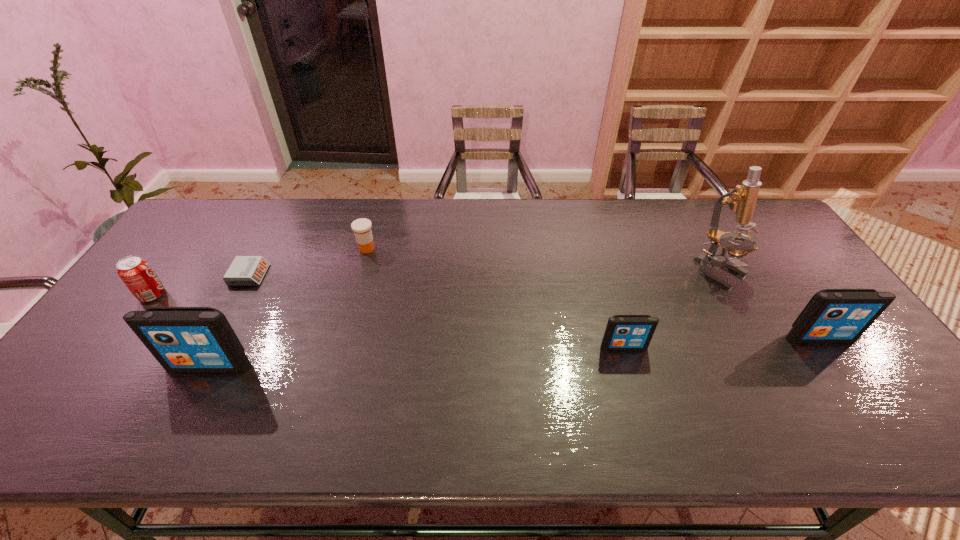
Please point a location where one more iPod can be added evenly. Please provide its 2D coordinates. Your answer should be formatted as a tuple, i.e. [(x, y)], where the tuple contains the x and y coordinates of a point satisfying the conditions above.

[(420, 356)]